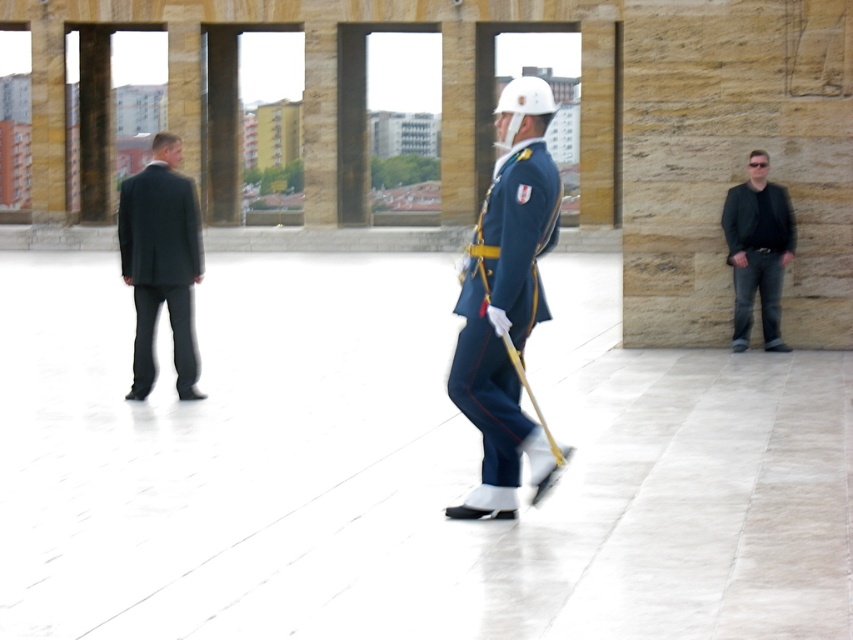
Question: Is blue uniform at center bigger than dark gray suit at left?

Choices:
 (A) no
 (B) yes

Answer: (A)

Question: Which is nearer to the dark gray suit at left?

Choices:
 (A) black leather jacket at right
 (B) blue uniform at center

Answer: (B)

Question: Which point is closer to the camera taking this photo?

Choices:
 (A) (756, 262)
 (B) (486, 307)

Answer: (B)

Question: Which object is positioned closest to the blue uniform at center?

Choices:
 (A) black leather jacket at right
 (B) dark gray suit at left

Answer: (B)

Question: Does dark gray suit at left have a smaller size compared to black leather jacket at right?

Choices:
 (A) no
 (B) yes

Answer: (B)

Question: In this image, where is blue uniform at center located relative to dark gray suit at left?

Choices:
 (A) below
 (B) above

Answer: (B)